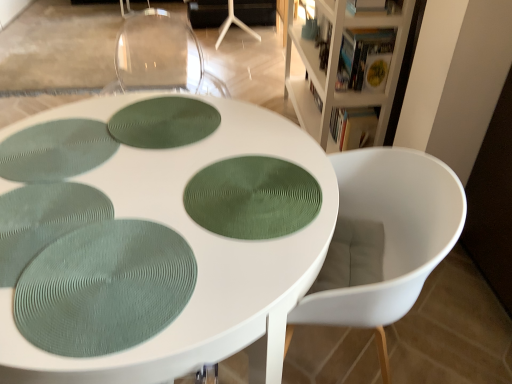
Find the location of a particular element. This screenshot has height=384, width=512. empty space that is in between green textured placemat at center, which ranks as the first oval in top-to-bottom order, and green textured placemat at center, acting as the second oval starting from the back is located at coordinates (199, 156).